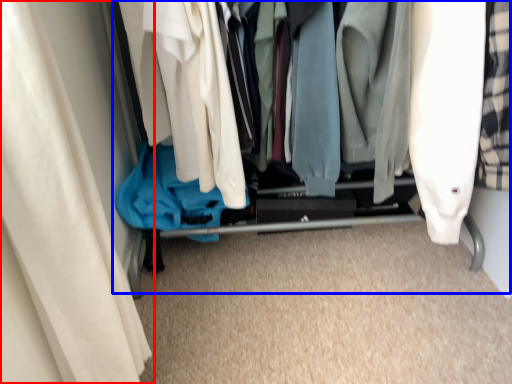
Question: Which point is further to the camera, curtain (highlighted by a red box) or closet (highlighted by a blue box)?

Choices:
 (A) curtain
 (B) closet

Answer: (B)